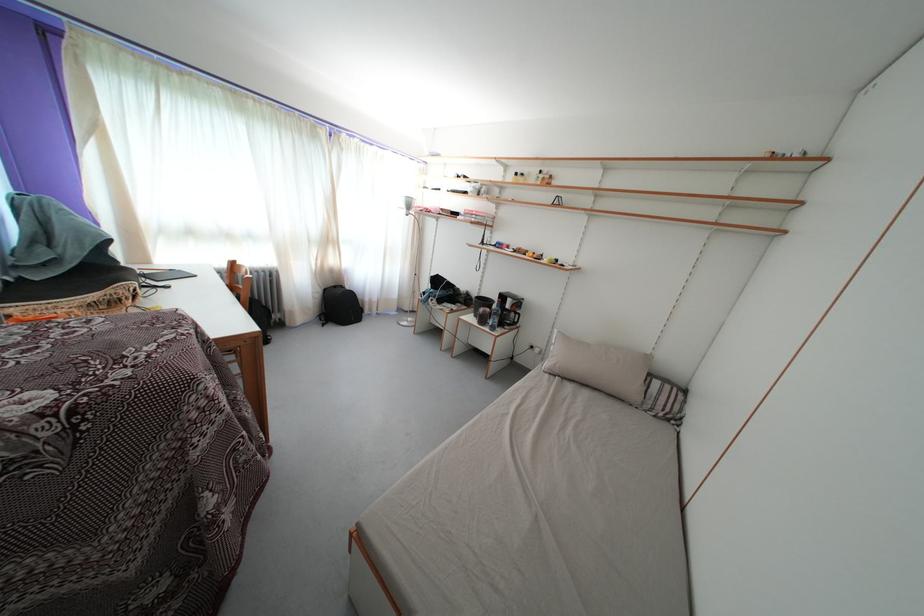
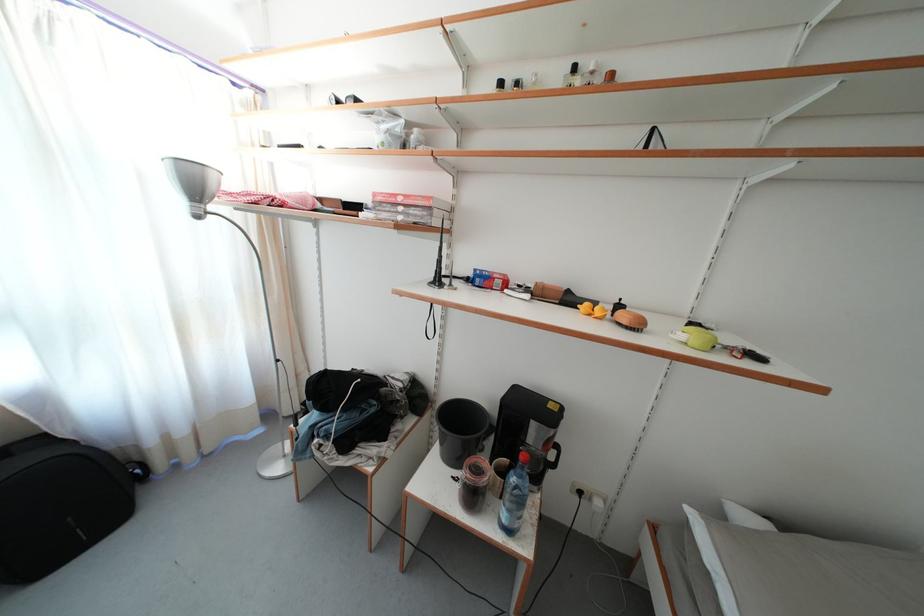
Question: The images are taken continuously from a first-person perspective. In which direction are you moving?

Choices:
 (A) Left
 (B) Right
 (C) Forward
 (D) Backward

Answer: (C)